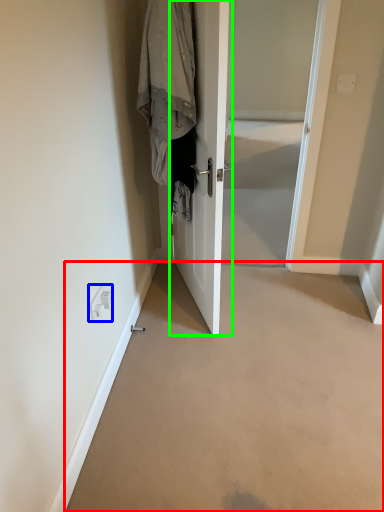
Question: Based on their relative distances, which object is nearer to corridor (highlighted by a red box)? Choose from electric outlet (highlighted by a blue box) and door (highlighted by a green box).

Choices:
 (A) electric outlet
 (B) door

Answer: (B)